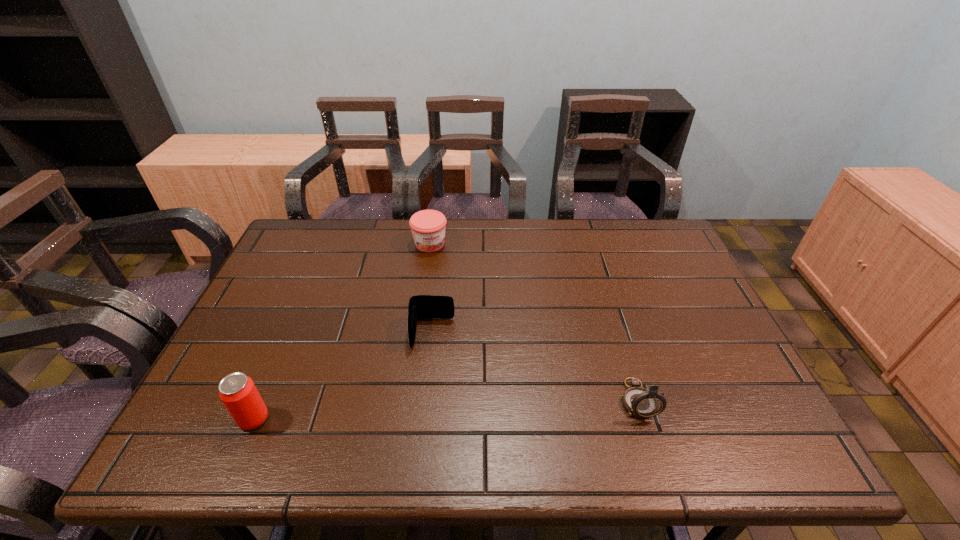
I want to click on vacant space on the desktop that is between the beer can and the rightmost object and is positioned on the front label of the jam, so click(500, 407).

You are a GUI agent. You are given a task and a screenshot of the screen. Output one action in this format:
    pyautogui.click(x=<x>, y=<y>)
    Task: Click on the vacant spot on the desktop that is between the leftmost object and the compass and is positioned on the outer surface of the third nearest object
    The width and height of the screenshot is (960, 540).
    Given the screenshot: What is the action you would take?
    pyautogui.click(x=427, y=410)